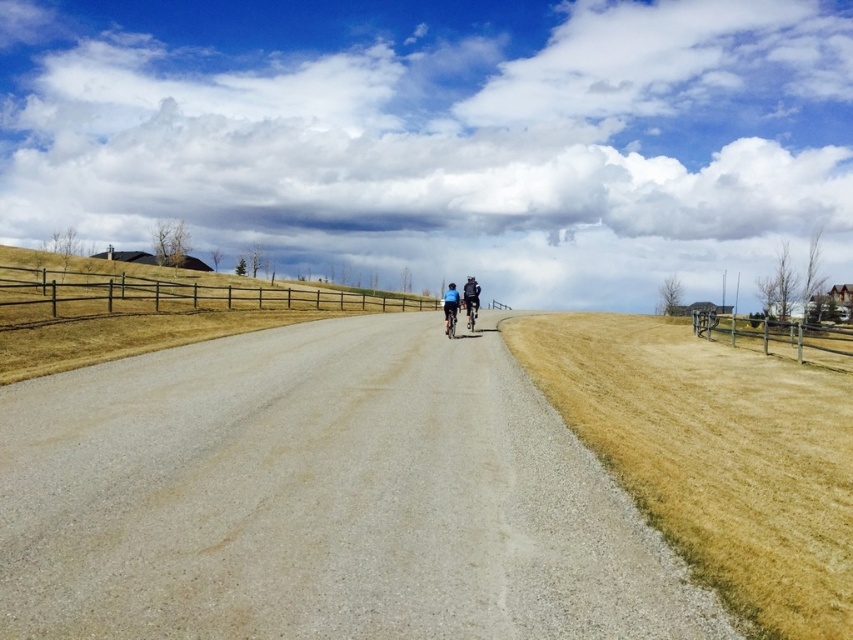
You are standing at the origin point in the image. Which direction should you move to reach the gray gravel road at center?

The gray gravel road at center is located at coordinates point (321, 499), so you should move towards the right and slightly downward from your current position at the origin to reach it.

You are a delivery person who needs to place a 30 meter long banner along the road between the wooden fence at right and the shiny metallic bicycle at center. Based on the scene, can you fit the banner along the road between those two objects?

The distance between the wooden fence at right and the shiny metallic bicycle at center is 28.49 meters. Since the banner is 30 meters long, it would not fit entirely between them as the space is shorter than the banner.

Consider the image. You are standing at the edge of the gray gravel road at center and looking towards the dark blue fabric jacket at center. Which direction should you walk to reach the jacket?

The gray gravel road at center is located below the dark blue fabric jacket at center, so you should walk upwards to reach the jacket.